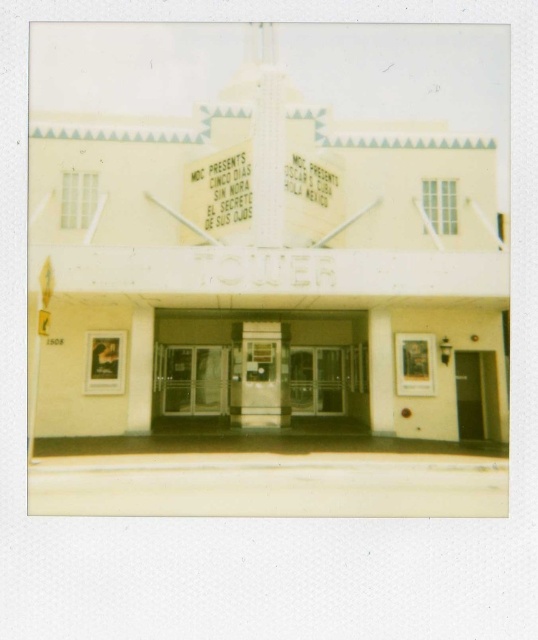
Question: Can you confirm if translucent glass doors at center is wider than black glass door at center?

Choices:
 (A) yes
 (B) no

Answer: (B)

Question: Which point appears farthest from the camera in this image?

Choices:
 (A) (95, 90)
 (B) (244, 369)
 (C) (482, 412)

Answer: (A)

Question: Does beige concrete theater at center lie behind black glass door at center?

Choices:
 (A) no
 (B) yes

Answer: (A)

Question: Estimate the real-world distances between objects in this image. Which object is closer to the translucent glass doors at center?

Choices:
 (A) clear glass doors at center
 (B) beige concrete theater at center

Answer: (A)

Question: Can you confirm if clear glass doors at center is bigger than black glass door at center?

Choices:
 (A) yes
 (B) no

Answer: (A)

Question: Estimate the real-world distances between objects in this image. Which object is closer to the beige concrete theater at center?

Choices:
 (A) black glass door at center
 (B) translucent glass doors at center

Answer: (A)